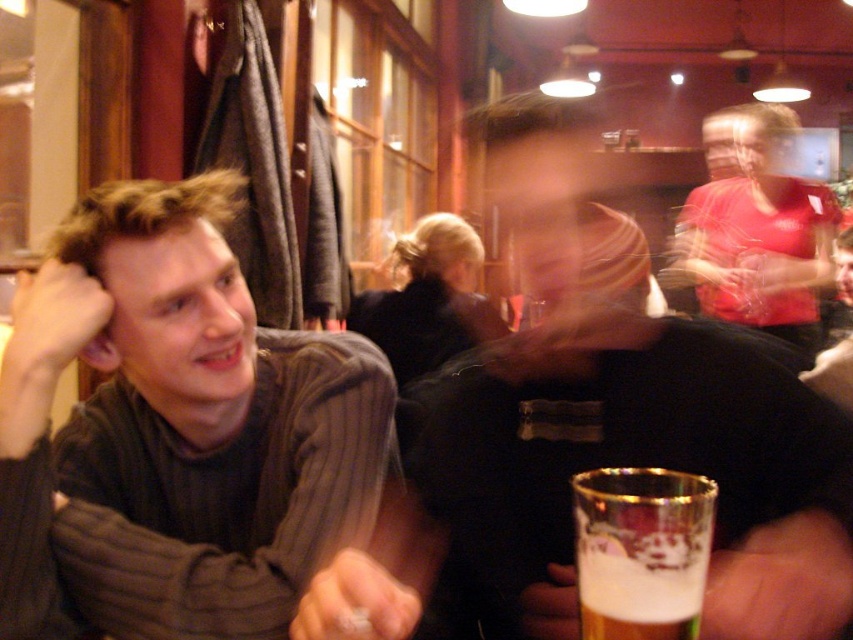
You are a photographer trying to capture the man in the foreground clearly. You notice two points of interest in the scene labeled as point (473, 531) and point (670, 280). Which point should you focus on to ensure the man is in sharp focus?

Point (473, 531) is closer to the camera than point (670, 280). Therefore, focusing on point (473, 531) will ensure the man in the foreground is in sharp focus.

You are standing in the pub and want to know which of the two points, point (750,141) or point (689,477), is closer to you. Can you determine this based on their positions?

Point (750,141) is closer to you because it is further to the viewer than point (689,477).

In the scene described, there are two shirts visible. The black matte shirt at center and the matte red shirt at upper right. Which shirt is positioned more to the left side of the image?

The black matte shirt at center is positioned more to the left side of the image than the matte red shirt at upper right.